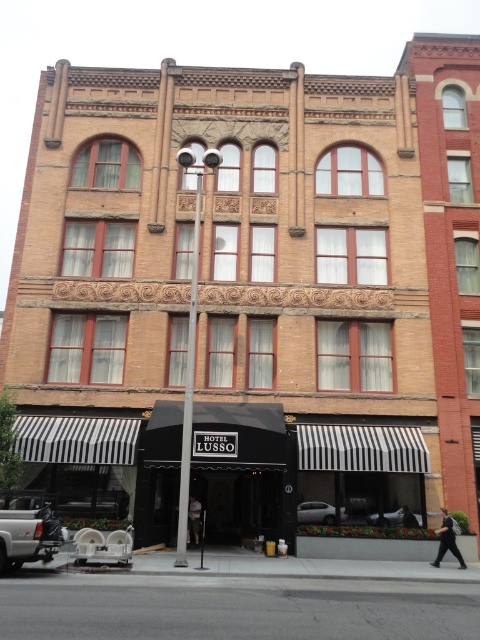
Question: In this image, where is silver metallic sedan at center located relative to dark gray fabric jacket at center?

Choices:
 (A) left
 (B) right

Answer: (B)

Question: Which point is closer to the camera taking this photo?

Choices:
 (A) (434, 563)
 (B) (156, 531)

Answer: (A)

Question: Which point appears closest to the camera in this image?

Choices:
 (A) (193, 516)
 (B) (307, 522)
 (C) (25, 525)

Answer: (C)

Question: Among these points, which one is farthest from the camera?

Choices:
 (A) (195, 273)
 (B) (191, 509)

Answer: (B)

Question: Considering the relative positions of white matte sedan at center and dark gray fabric jacket at center in the image provided, where is white matte sedan at center located with respect to dark gray fabric jacket at center?

Choices:
 (A) right
 (B) left

Answer: (A)

Question: Is silver metallic truck at lower left further to camera compared to white matte sedan at center?

Choices:
 (A) no
 (B) yes

Answer: (A)